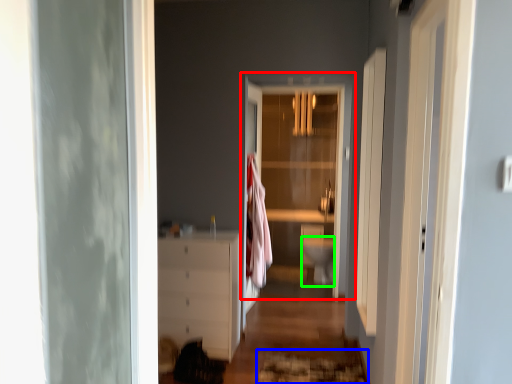
Question: Which object is positioned closest to door (highlighted by a red box)? Select from doormat (highlighted by a blue box) and toilet bowl (highlighted by a green box).

Choices:
 (A) doormat
 (B) toilet bowl

Answer: (B)